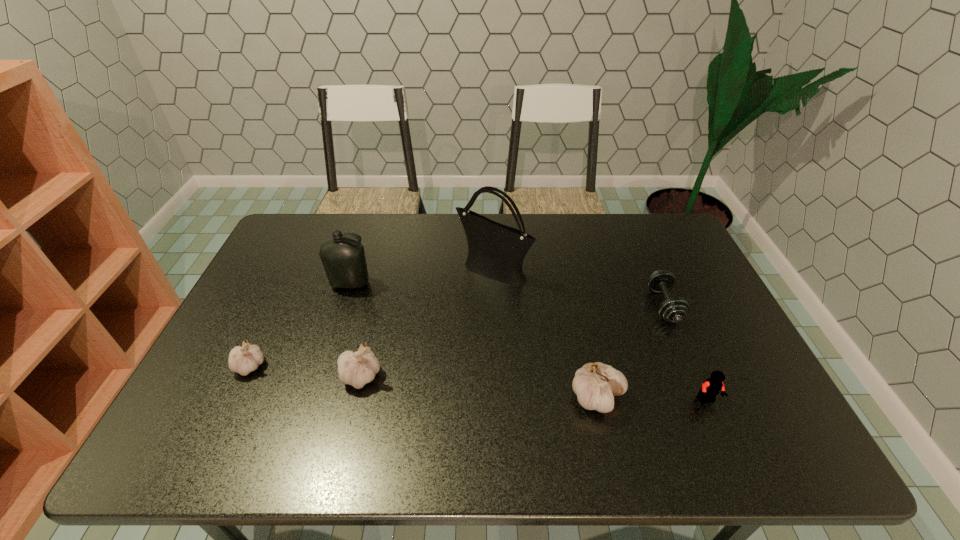
Where is `the leftmost garlic`? This screenshot has width=960, height=540. the leftmost garlic is located at coordinates (243, 360).

You are a GUI agent. You are given a task and a screenshot of the screen. Output one action in this format:
    pyautogui.click(x=<x>, y=<y>)
    Task: Click on the shortest garlic
    The image size is (960, 540).
    Given the screenshot: What is the action you would take?
    click(x=243, y=360)

Find the location of a particular element. The width and height of the screenshot is (960, 540). the second garlic from left to right is located at coordinates click(x=359, y=368).

The width and height of the screenshot is (960, 540). Identify the location of the second tallest garlic. (359, 368).

Where is `the tallest garlic`? the tallest garlic is located at coordinates (595, 384).

This screenshot has height=540, width=960. In order to click on the third object from right to left in this screenshot , I will do pos(595,384).

Where is `the fourth object from right to left`? the fourth object from right to left is located at coordinates (496, 251).

Where is `shoulder bag`? shoulder bag is located at coordinates (496, 251).

You are a GUI agent. You are given a task and a screenshot of the screen. Output one action in this format:
    pyautogui.click(x=<x>, y=<y>)
    Task: Click on the second tallest object
    
    Given the screenshot: What is the action you would take?
    pyautogui.click(x=343, y=259)

Locate an element on the screen. The image size is (960, 540). Lego is located at coordinates (712, 386).